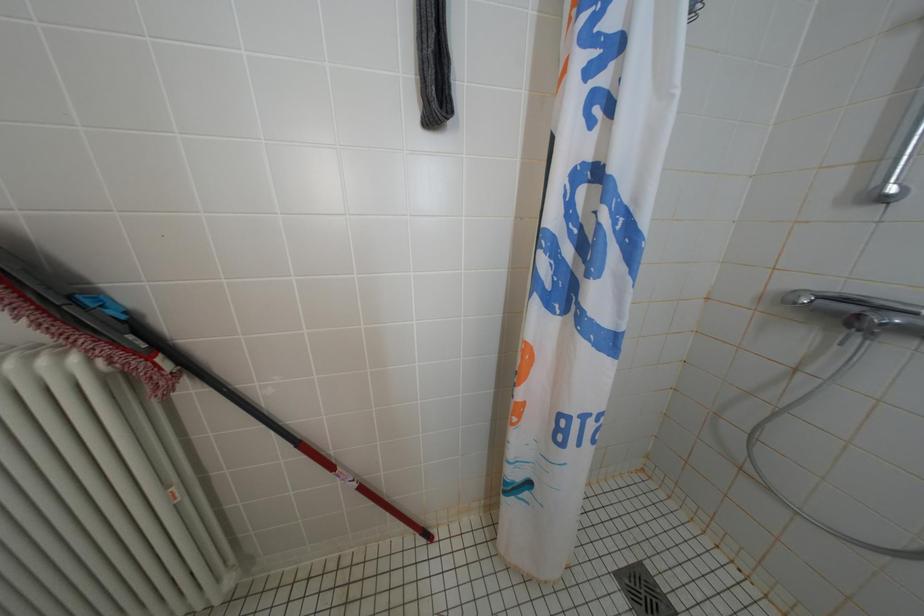
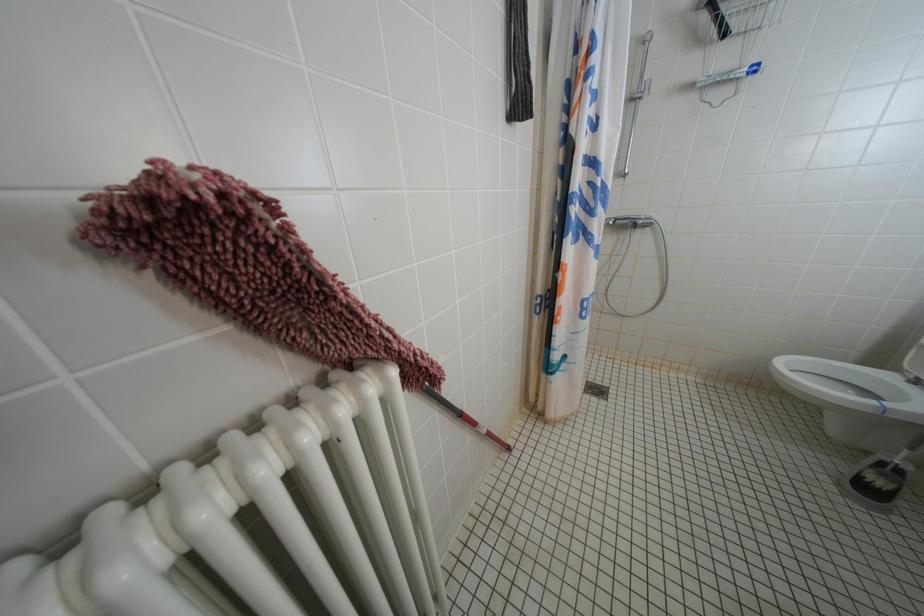
Question: The images are taken continuously from a first-person perspective. In which direction is your viewpoint rotating?

Choices:
 (A) Left
 (B) Right
 (C) Up
 (D) Down

Answer: (B)